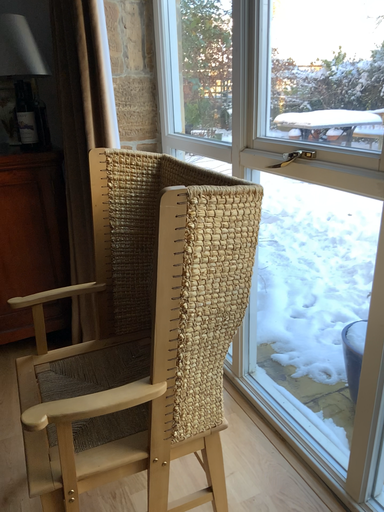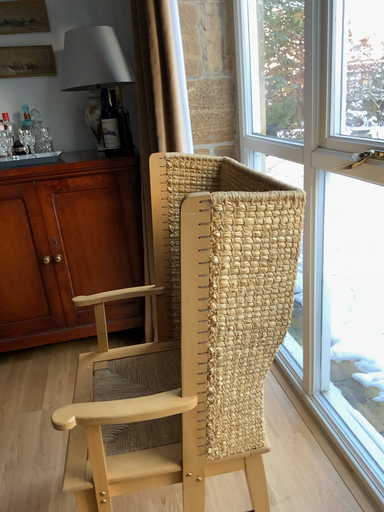
Question: How did the camera likely rotate when shooting the video?

Choices:
 (A) rotated left
 (B) rotated right

Answer: (A)